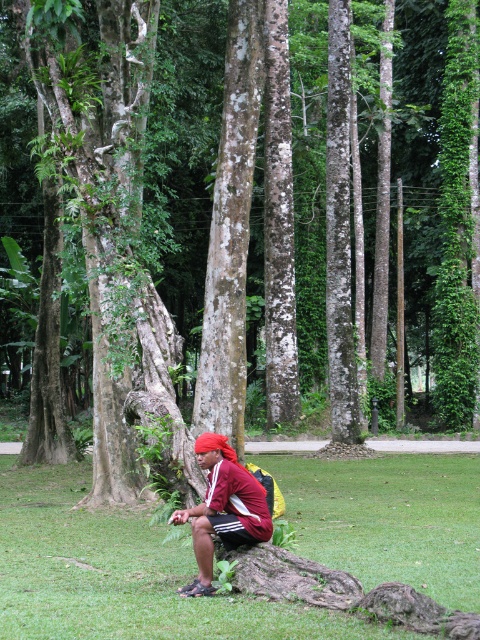
Question: Is green grass at lower center wider than maroon fabric shirt at center?

Choices:
 (A) no
 (B) yes

Answer: (B)

Question: Which of the following is the closest to the observer?

Choices:
 (A) (403, 522)
 (B) (252, 524)

Answer: (B)

Question: Which object appears closest to the camera in this image?

Choices:
 (A) green grass at lower center
 (B) maroon fabric shirt at center

Answer: (A)

Question: From the image, what is the correct spatial relationship of green grass at lower center in relation to maroon fabric shirt at center?

Choices:
 (A) left
 (B) right

Answer: (A)

Question: In this image, where is green grass at lower center located relative to maroon fabric shirt at center?

Choices:
 (A) left
 (B) right

Answer: (A)